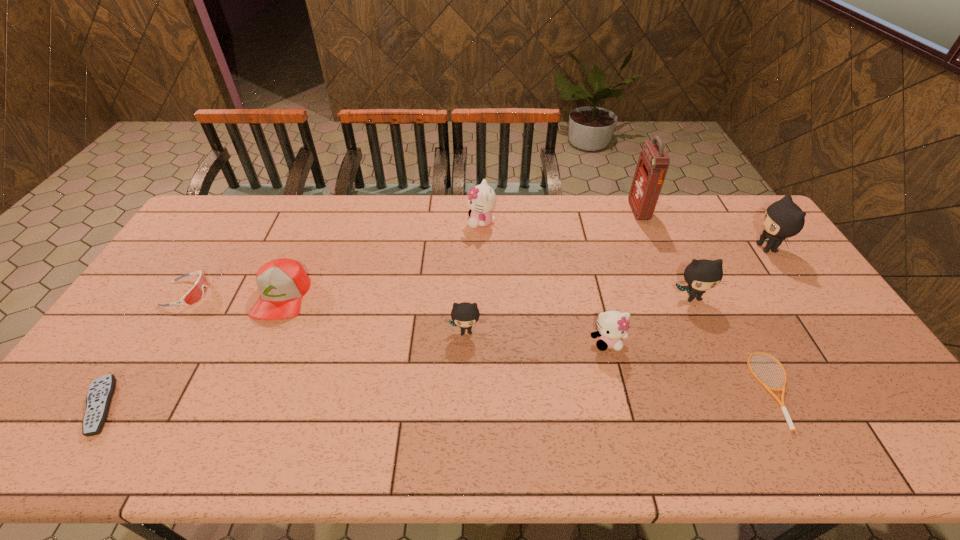
At what (x,y) coordinates should I click in order to perform the action: click on free space between the goggles and the red first-aid kit. Please return your answer as a coordinate pair (x, y). Looking at the image, I should click on (412, 252).

Where is `vacant space that is in between the seventh tallest object and the second kitten from right to left`? The height and width of the screenshot is (540, 960). vacant space that is in between the seventh tallest object and the second kitten from right to left is located at coordinates (487, 297).

You are a GUI agent. You are given a task and a screenshot of the screen. Output one action in this format:
    pyautogui.click(x=<x>, y=<y>)
    Task: Click on the vacant space that's between the red goggles and the second kitten from right to left
    
    Given the screenshot: What is the action you would take?
    pyautogui.click(x=439, y=295)

I want to click on vacant space in between the smaller white kitten and the shortest object, so click(x=692, y=366).

Where is `empty space that is in between the nearest gray kitten and the beige tennis racket`? The height and width of the screenshot is (540, 960). empty space that is in between the nearest gray kitten and the beige tennis racket is located at coordinates [621, 361].

The height and width of the screenshot is (540, 960). I want to click on vacant space that's between the beige tennis racket and the sixth object from left to right, so click(x=692, y=366).

At what (x,y) coordinates should I click in order to perform the action: click on free space between the red first-aid kit and the beige tennis racket. Please return your answer as a coordinate pair (x, y). Looking at the image, I should click on (708, 300).

Where is `unoccupied area between the goggles and the smaller white kitten`? The width and height of the screenshot is (960, 540). unoccupied area between the goggles and the smaller white kitten is located at coordinates (396, 318).

At what (x,y) coordinates should I click in order to perform the action: click on unoccupied position between the remote control and the goggles. Please return your answer as a coordinate pair (x, y). Looking at the image, I should click on (143, 349).

Where is `the eighth closest object relative to the fourth kitten from left to right`? the eighth closest object relative to the fourth kitten from left to right is located at coordinates (196, 292).